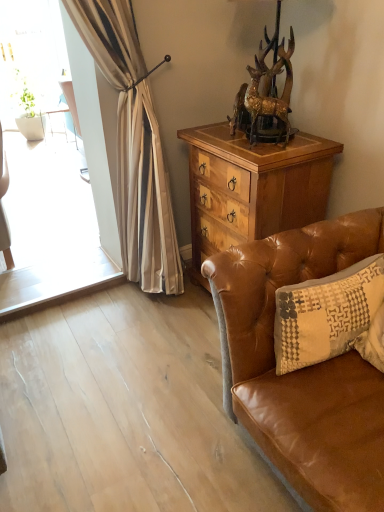
Question: Considering the relative sizes of wooden cabinet at center and beige textured pillow at right in the image provided, is wooden cabinet at center smaller than beige textured pillow at right?

Choices:
 (A) yes
 (B) no

Answer: (B)

Question: From the image's perspective, is wooden cabinet at center located above beige textured pillow at right?

Choices:
 (A) no
 (B) yes

Answer: (B)

Question: Considering the relative sizes of wooden cabinet at center and beige textured pillow at right in the image provided, is wooden cabinet at center taller than beige textured pillow at right?

Choices:
 (A) yes
 (B) no

Answer: (A)

Question: Is the depth of wooden cabinet at center greater than that of beige textured pillow at right?

Choices:
 (A) yes
 (B) no

Answer: (A)

Question: Is beige textured pillow at right completely or partially inside wooden cabinet at center?

Choices:
 (A) no
 (B) yes

Answer: (A)

Question: Can you confirm if wooden cabinet at center is shorter than beige textured pillow at right?

Choices:
 (A) yes
 (B) no

Answer: (B)

Question: Is brown leather couch at lower right smaller than gold metallic deer at upper center?

Choices:
 (A) yes
 (B) no

Answer: (B)

Question: From the image's perspective, does brown leather couch at lower right appear higher than gold metallic deer at upper center?

Choices:
 (A) yes
 (B) no

Answer: (B)

Question: Can we say brown leather couch at lower right lies outside gold metallic deer at upper center?

Choices:
 (A) no
 (B) yes

Answer: (B)

Question: Can you confirm if brown leather couch at lower right is shorter than gold metallic deer at upper center?

Choices:
 (A) no
 (B) yes

Answer: (A)

Question: Is brown leather couch at lower right at the left side of gold metallic deer at upper center?

Choices:
 (A) yes
 (B) no

Answer: (B)

Question: Is brown leather couch at lower right oriented away from gold metallic deer at upper center?

Choices:
 (A) no
 (B) yes

Answer: (A)

Question: Are gold metallic deer at upper center and brown leather couch at lower right making contact?

Choices:
 (A) yes
 (B) no

Answer: (B)